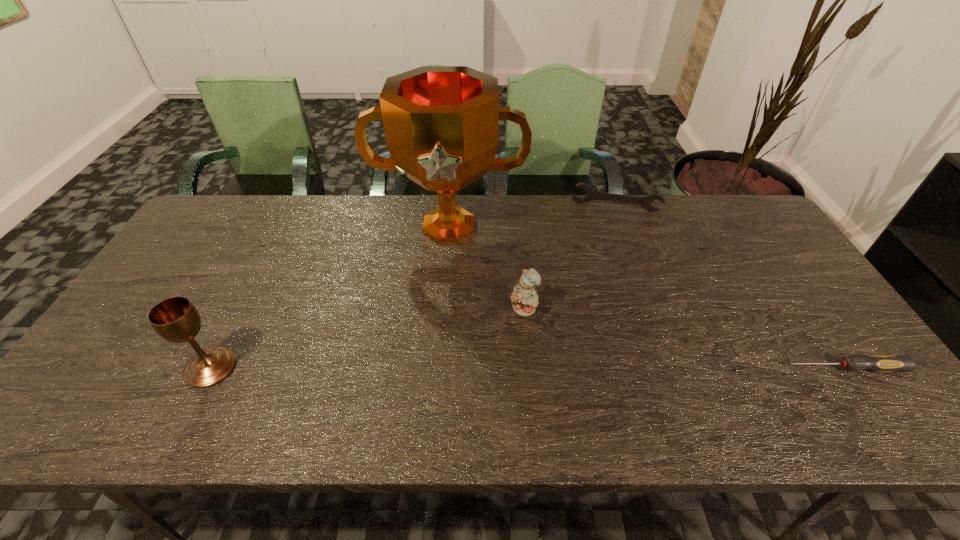
Where is `chalice`? The height and width of the screenshot is (540, 960). chalice is located at coordinates 175,319.

Locate an element on the screen. This screenshot has width=960, height=540. the leftmost object is located at coordinates (175, 319).

The image size is (960, 540). Identify the location of screwdriver. (876, 363).

Where is `the shortest object`? Image resolution: width=960 pixels, height=540 pixels. the shortest object is located at coordinates (876, 363).

Locate an element on the screen. This screenshot has height=540, width=960. teddy bear is located at coordinates (524, 298).

Identify the location of the third tallest object. (524, 298).

Identify the location of award. This screenshot has width=960, height=540. (441, 122).

The width and height of the screenshot is (960, 540). Find the location of `the second shortest object`. the second shortest object is located at coordinates (592, 194).

Where is `wrench`? wrench is located at coordinates (592, 194).

Identify the location of free location located on the back of the chalice. (240, 310).